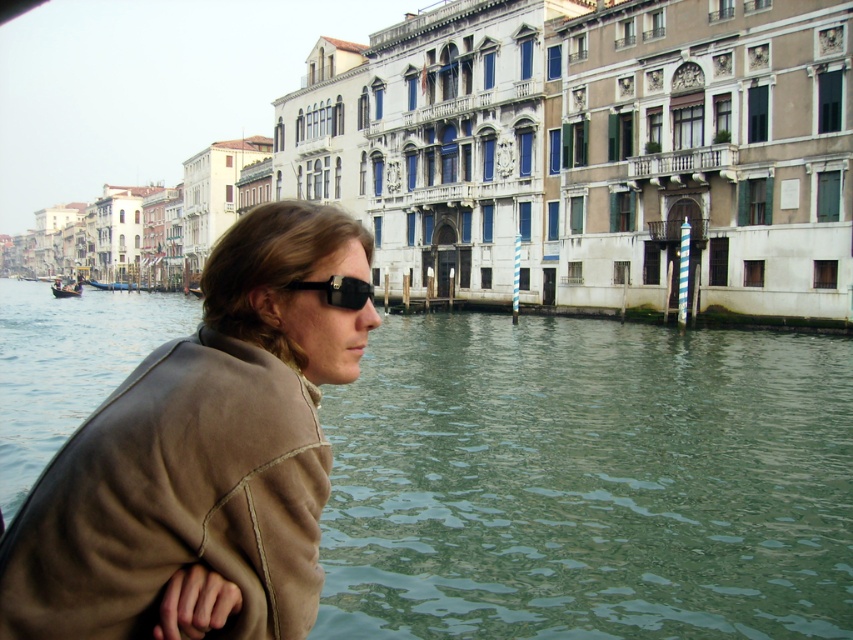
You are a tourist standing on the bridge overlooking the canal. You notice the green water at lower left and the black matte sunglasses at upper left. Which object is closer to you?

The green water at lower left is closer to you because the black matte sunglasses at upper left is behind it.

You are standing on a bridge overlooking the canal. You notice two items in the scene described as green water at lower left and brown leather jacket at left. Which of these is positioned to the left of the other?

The green water at lower left is positioned to the left of the brown leather jacket at left.

You are standing on the dock and see the brown leather jacket at left and the wooden gondola at left. Which object is positioned to the right side?

The brown leather jacket at left is positioned to the right of the wooden gondola at left.